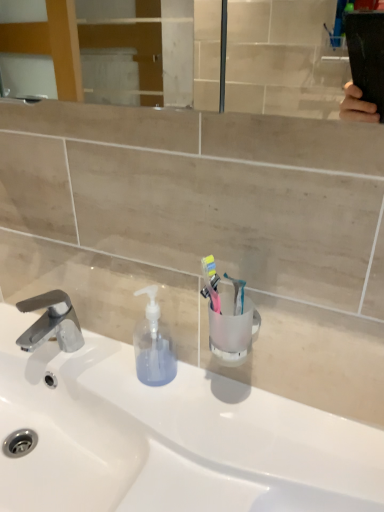
The height and width of the screenshot is (512, 384). In order to click on free space in front of transparent plastic soap dispenser at center in this screenshot , I will do `click(174, 436)`.